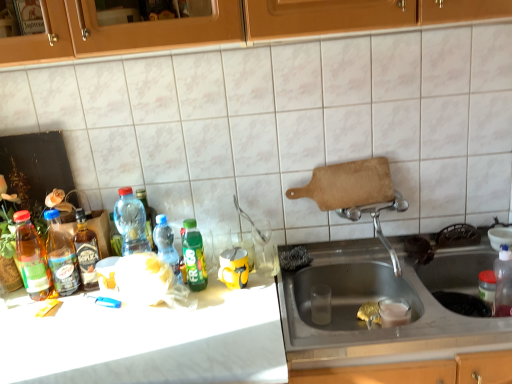
Question: Is stainless steel sink at lower right next to translucent plastic bottle at center, positioned as the 3th bottle in right-to-left order, and touching it?

Choices:
 (A) no
 (B) yes

Answer: (A)

Question: Can you confirm if stainless steel sink at lower right is smaller than translucent plastic bottle at center, which is counted as the 5th bottle, starting from the left?

Choices:
 (A) yes
 (B) no

Answer: (B)

Question: Is translucent plastic bottle at center, positioned as the 3th bottle in right-to-left order, surrounded by stainless steel sink at lower right?

Choices:
 (A) yes
 (B) no

Answer: (B)

Question: Does stainless steel sink at lower right have a greater width compared to translucent plastic bottle at center, positioned as the 3th bottle in right-to-left order?

Choices:
 (A) no
 (B) yes

Answer: (B)

Question: Is stainless steel sink at lower right positioned far away from translucent plastic bottle at center, positioned as the 3th bottle in right-to-left order?

Choices:
 (A) yes
 (B) no

Answer: (B)

Question: In the image, is translucent plastic bottle at center, which is counted as the 5th bottle, starting from the left, positioned in front of or behind translucent glass bottle at left, which is counted as the third bottle, starting from the left?

Choices:
 (A) behind
 (B) front

Answer: (A)

Question: Visually, is translucent plastic bottle at center, which is counted as the 5th bottle, starting from the left, positioned to the left or to the right of translucent glass bottle at left, which is counted as the third bottle, starting from the left?

Choices:
 (A) left
 (B) right

Answer: (B)

Question: Do you think translucent plastic bottle at center, positioned as the 3th bottle in right-to-left order, is within translucent glass bottle at left, which is counted as the third bottle, starting from the left, or outside of it?

Choices:
 (A) inside
 (B) outside

Answer: (B)

Question: From the image's perspective, is translucent plastic bottle at center, positioned as the 3th bottle in right-to-left order, above or below translucent glass bottle at left, the fifth bottle when ordered from right to left?

Choices:
 (A) below
 (B) above

Answer: (B)

Question: Would you say translucent plastic bottle at center, which is counted as the 5th bottle, starting from the left, is inside or outside green matte bottle at center, which is counted as the sixth bottle, starting from the left?

Choices:
 (A) inside
 (B) outside

Answer: (B)

Question: From the image's perspective, is translucent plastic bottle at center, positioned as the 3th bottle in right-to-left order, located above or below green matte bottle at center, which is counted as the second bottle, starting from the right?

Choices:
 (A) below
 (B) above

Answer: (B)

Question: In terms of width, does translucent plastic bottle at center, positioned as the 3th bottle in right-to-left order, look wider or thinner when compared to green matte bottle at center, which is counted as the second bottle, starting from the right?

Choices:
 (A) thin
 (B) wide

Answer: (B)

Question: Based on their positions, is translucent plastic bottle at center, positioned as the 3th bottle in right-to-left order, located to the left or right of green matte bottle at center, which is counted as the sixth bottle, starting from the left?

Choices:
 (A) left
 (B) right

Answer: (A)

Question: Is translucent glass bottle at left, the fifth bottle when ordered from right to left, taller or shorter than stainless steel sink at lower right?

Choices:
 (A) tall
 (B) short

Answer: (A)

Question: From a real-world perspective, relative to stainless steel sink at lower right, is translucent glass bottle at left, which is counted as the third bottle, starting from the left, vertically above or below?

Choices:
 (A) above
 (B) below

Answer: (A)